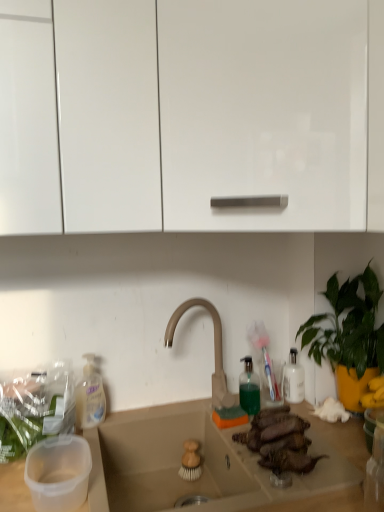
What is the approximate width of green translucent bottle at center-right, the first bottle from the right?

It is 2.00 inches.

Describe the element at coordinates (214, 349) in the screenshot. I see `beige matte faucet at center` at that location.

In order to face green leafy plant at right, should I rotate leftwards or rightwards?

You should look right and rotate roughly 20.436 degrees.

Measure the distance between white glossy cabinet at upper left, the first cabinetry in the left-to-right sequence, and camera.

white glossy cabinet at upper left, the first cabinetry in the left-to-right sequence, is 77.16 centimeters from camera.

Locate an element on the screen. This screenshot has width=384, height=512. brown matte meat at center is located at coordinates (279, 440).

Is transparent plastic soap dispenser at lower left, the 1th bottle viewed from the left, in contact with beige matte faucet at center?

They are not placed beside each other.

From a real-world perspective, which object rests below the other?

transparent plastic soap dispenser at lower left, which is counted as the 2th bottle, starting from the right, is physically lower.

What's the angular difference between transparent plastic soap dispenser at lower left, the 1th bottle viewed from the left, and beige matte faucet at center's facing directions?

The angular difference between transparent plastic soap dispenser at lower left, the 1th bottle viewed from the left, and beige matte faucet at center is 0.379 degrees.

Where is `bottle on the left of beige matte faucet at center`? Image resolution: width=384 pixels, height=512 pixels. bottle on the left of beige matte faucet at center is located at coordinates (90, 395).

Looking at this image, is beige matte faucet at center to the right of green translucent bottle at center-right, the first bottle from the right, from the viewer's perspective?

No, beige matte faucet at center is not to the right of green translucent bottle at center-right, the first bottle from the right.

The height and width of the screenshot is (512, 384). I want to click on tap above the green translucent bottle at center-right, arranged as the second bottle when viewed from the left (from the image's perspective), so click(214, 349).

Is beige matte faucet at center taller than green translucent bottle at center-right, the first bottle from the right?

Indeed, beige matte faucet at center has a greater height compared to green translucent bottle at center-right, the first bottle from the right.

From the picture: Is green translucent bottle at center-right, arranged as the second bottle when viewed from the left, at the back of beige matte faucet at center?

No, beige matte faucet at center's orientation is not away from green translucent bottle at center-right, arranged as the second bottle when viewed from the left.

Could you tell me if green leafy plant at right is turned towards green translucent bottle at center-right, the first bottle from the right?

Yes, green leafy plant at right is facing green translucent bottle at center-right, the first bottle from the right.

From their relative heights in the image, would you say green leafy plant at right is taller or shorter than green translucent bottle at center-right, the first bottle from the right?

Considering their sizes, green leafy plant at right has more height than green translucent bottle at center-right, the first bottle from the right.

Can you confirm if green leafy plant at right is bigger than green translucent bottle at center-right, arranged as the second bottle when viewed from the left?

Yes.

Is point (365, 284) positioned behind point (255, 406)?

No, it is in front of (255, 406).

Can you confirm if beige matte faucet at center is thinner than brown matte meat at center?

Yes, beige matte faucet at center is thinner than brown matte meat at center.

From the image's perspective, which object appears higher, beige matte faucet at center or brown matte meat at center?

beige matte faucet at center appears higher in the image.

Is beige matte faucet at center aimed at brown matte meat at center?

Yes, beige matte faucet at center is aimed at brown matte meat at center.

Which object is closer to the camera taking this photo, beige matte faucet at center or brown matte meat at center?

brown matte meat at center.

Is glossy white cabinet at upper center, which is the 1th cabinetry from right to left, shorter than beige matte faucet at center?

In fact, glossy white cabinet at upper center, which is the 1th cabinetry from right to left, may be taller than beige matte faucet at center.

Locate an element on the screen. This screenshot has width=384, height=512. tap on the left of glossy white cabinet at upper center, the second cabinetry viewed from the left is located at coordinates (214, 349).

How different are the orientations of glossy white cabinet at upper center, which is the 1th cabinetry from right to left, and beige matte faucet at center in degrees?

glossy white cabinet at upper center, which is the 1th cabinetry from right to left, and beige matte faucet at center are facing 44.6 degrees away from each other.

Is glossy white cabinet at upper center, which is the 1th cabinetry from right to left, touching beige matte faucet at center?

No, glossy white cabinet at upper center, which is the 1th cabinetry from right to left, is not next to beige matte faucet at center.

Who is more distant, green leafy plant at right or brown matte meat at center?

Positioned behind is green leafy plant at right.

Is green leafy plant at right far from brown matte meat at center?

No, green leafy plant at right is in close proximity to brown matte meat at center.

From their relative heights in the image, would you say green leafy plant at right is taller or shorter than brown matte meat at center?

In the image, green leafy plant at right appears to be taller than brown matte meat at center.

How distant is green leafy plant at right from brown matte meat at center?

green leafy plant at right and brown matte meat at center are 30.21 centimeters apart.

Between beige matte faucet at center and green leafy plant at right, which one has larger width?

green leafy plant at right is wider.

Is beige matte faucet at center not within green leafy plant at right?

Yes, beige matte faucet at center is outside of green leafy plant at right.

Does point (219, 371) appear closer or farther from the camera than point (374, 337)?

Point (219, 371) is positioned farther from the camera compared to point (374, 337).

I want to click on tap that appears on the right of transparent plastic soap dispenser at lower left, the 1th bottle viewed from the left, so (214, 349).

What are the coordinates of `tap located above the green translucent bottle at center-right, arranged as the second bottle when viewed from the left (from a real-world perspective)` in the screenshot? It's located at click(x=214, y=349).

Estimate the real-world distances between objects in this image. Which object is closer to brown matte meat at center, green translucent bottle at center-right, arranged as the second bottle when viewed from the left, or glossy white cabinet at upper center, the second cabinetry viewed from the left?

green translucent bottle at center-right, arranged as the second bottle when viewed from the left, lies closer to brown matte meat at center than the other object.

Based on their spatial positions, is glossy white cabinet at upper center, which is the 1th cabinetry from right to left, or green leafy plant at right closer to transparent plastic soap dispenser at lower left, the 1th bottle viewed from the left?

green leafy plant at right is closer to transparent plastic soap dispenser at lower left, the 1th bottle viewed from the left.

Estimate the real-world distances between objects in this image. Which object is further from brown matte meat at center, green translucent bottle at center-right, arranged as the second bottle when viewed from the left, or green leafy plant at right?

Based on the image, green leafy plant at right appears to be further to brown matte meat at center.

When comparing their distances from beige matte countertop at center, does white glossy cabinet at upper left, arranged as the second cabinetry when viewed from the right, or green translucent bottle at center-right, the first bottle from the right, seem further?

Based on the image, white glossy cabinet at upper left, arranged as the second cabinetry when viewed from the right, appears to be further to beige matte countertop at center.

Which object lies further to the anchor point white glossy cabinet at upper left, arranged as the second cabinetry when viewed from the right, beige matte countertop at center or green leafy plant at right?

Based on the image, green leafy plant at right appears to be further to white glossy cabinet at upper left, arranged as the second cabinetry when viewed from the right.

Looking at the image, which one is located further to glossy white cabinet at upper center, which is the 1th cabinetry from right to left, white glossy cabinet at upper left, arranged as the second cabinetry when viewed from the right, or green leafy plant at right?

green leafy plant at right is positioned further to the anchor glossy white cabinet at upper center, which is the 1th cabinetry from right to left.

Based on their spatial positions, is beige matte faucet at center or green translucent bottle at center-right, the first bottle from the right, further from glossy white cabinet at upper center, the second cabinetry viewed from the left?

Based on the image, green translucent bottle at center-right, the first bottle from the right, appears to be further to glossy white cabinet at upper center, the second cabinetry viewed from the left.

When comparing their distances from green leafy plant at right, does glossy white cabinet at upper center, the second cabinetry viewed from the left, or green translucent bottle at center-right, arranged as the second bottle when viewed from the left, seem further?

Based on the image, glossy white cabinet at upper center, the second cabinetry viewed from the left, appears to be further to green leafy plant at right.

Identify the location of tap between glossy white cabinet at upper center, the second cabinetry viewed from the left, and green translucent bottle at center-right, the first bottle from the right, in the vertical direction. (214, 349).

Find the location of a particular element. bottle between transparent plastic soap dispenser at lower left, which is counted as the 2th bottle, starting from the right, and brown matte meat at center is located at coordinates (249, 388).

Identify the location of tap between white glossy cabinet at upper left, arranged as the second cabinetry when viewed from the right, and green translucent bottle at center-right, arranged as the second bottle when viewed from the left, from top to bottom. (214, 349).

Find the location of a particular element. This screenshot has width=384, height=512. houseplant between brown matte meat at center and green translucent bottle at center-right, the first bottle from the right, in the front-back direction is located at coordinates (348, 336).